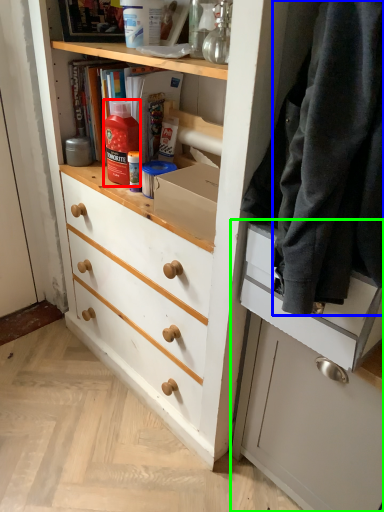
Question: Which object is positioned closest to bottle (highlighted by a red box)? Select from clothing (highlighted by a blue box) and cabinetry (highlighted by a green box).

Choices:
 (A) clothing
 (B) cabinetry

Answer: (A)